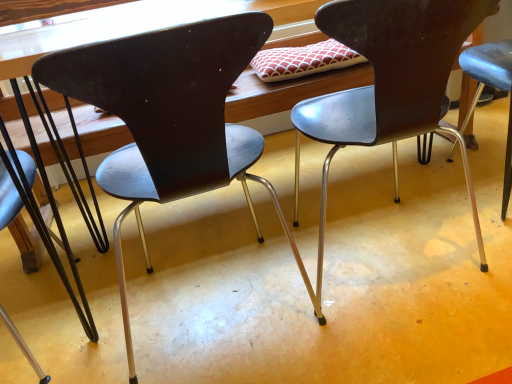
Where is `vacant space underneath metallic dark brown chair at left, the 3th chair in the right-to-left sequence (from a real-world perspective)`? Image resolution: width=512 pixels, height=384 pixels. vacant space underneath metallic dark brown chair at left, the 3th chair in the right-to-left sequence (from a real-world perspective) is located at coordinates (34, 320).